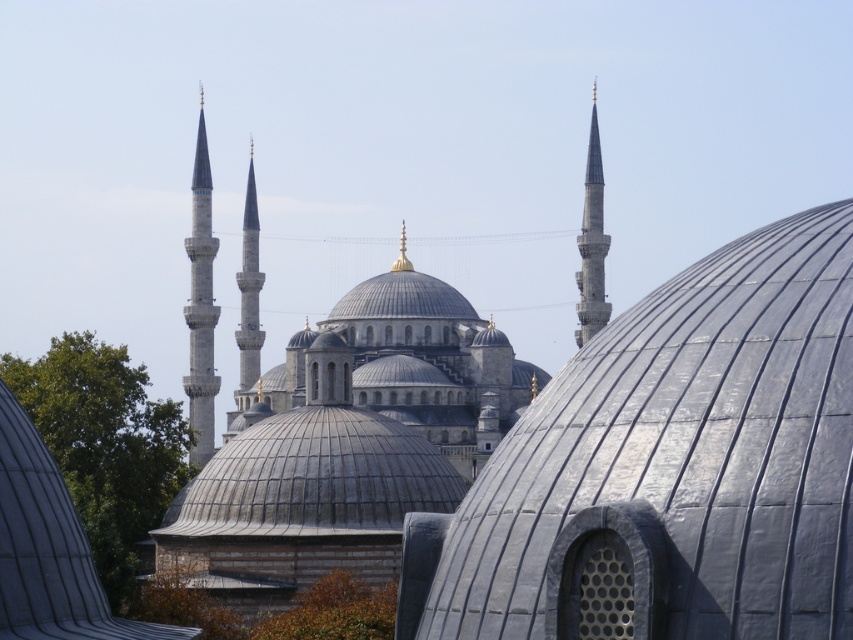
Which is above, gray metallic dome at center or smooth silver spire at right?

Positioned higher is smooth silver spire at right.

Can you confirm if gray metallic dome at center is smaller than smooth silver spire at right?

No, gray metallic dome at center is not smaller than smooth silver spire at right.

Does point (532, 401) lie behind point (596, 200)?

No, (532, 401) is in front of (596, 200).

I want to click on gray metallic dome at center, so click(x=670, y=467).

Which is more to the left, gray metallic dome at center or gray stone dome at center?

From the viewer's perspective, gray stone dome at center appears more on the left side.

Can you confirm if gray metallic dome at center is positioned above gray stone dome at center?

Yes, gray metallic dome at center is above gray stone dome at center.

Consider the image. Measure the distance between point (x=451, y=557) and camera.

The distance of point (x=451, y=557) from camera is 149.79 feet.

Image resolution: width=853 pixels, height=640 pixels. I want to click on gray metallic dome at center, so click(670, 467).

Consider the image. Is gray stone dome at center further to the viewer compared to smooth white minaret at left?

No, it is in front of smooth white minaret at left.

Does gray stone dome at center have a smaller size compared to smooth white minaret at left?

Yes, gray stone dome at center is smaller than smooth white minaret at left.

Identify the location of gray stone dome at center. (49, 548).

The width and height of the screenshot is (853, 640). In order to click on gray stone dome at center in this screenshot , I will do `click(49, 548)`.